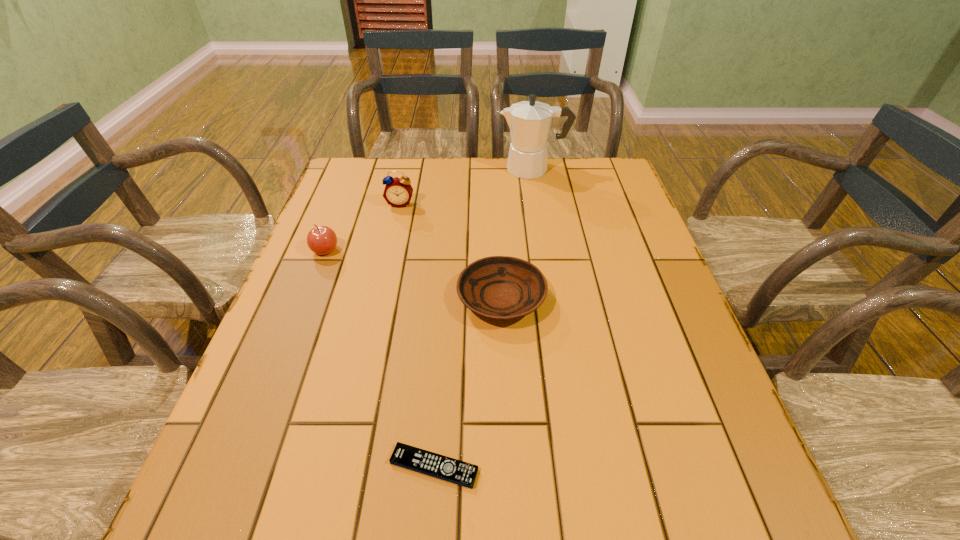
Where is `the farthest object`? This screenshot has width=960, height=540. the farthest object is located at coordinates (529, 121).

Image resolution: width=960 pixels, height=540 pixels. I want to click on coffeepot, so click(529, 121).

The height and width of the screenshot is (540, 960). Find the location of `the second object from left to right`. the second object from left to right is located at coordinates (398, 191).

This screenshot has width=960, height=540. I want to click on the second farthest object, so click(x=398, y=191).

This screenshot has width=960, height=540. What are the coordinates of `apple` in the screenshot? It's located at (322, 240).

You are a GUI agent. You are given a task and a screenshot of the screen. Output one action in this format:
    pyautogui.click(x=<x>, y=<y>)
    Task: Click on the third shortest object
    The height and width of the screenshot is (540, 960).
    Given the screenshot: What is the action you would take?
    pyautogui.click(x=322, y=240)

This screenshot has height=540, width=960. Find the location of `the second shortest object`. the second shortest object is located at coordinates (497, 287).

Find the location of a particular element. The width and height of the screenshot is (960, 540). the fourth farthest object is located at coordinates (497, 287).

Where is `the nearest object`? the nearest object is located at coordinates (455, 471).

Find the location of a particular element. Image resolution: width=960 pixels, height=540 pixels. the shortest object is located at coordinates (455, 471).